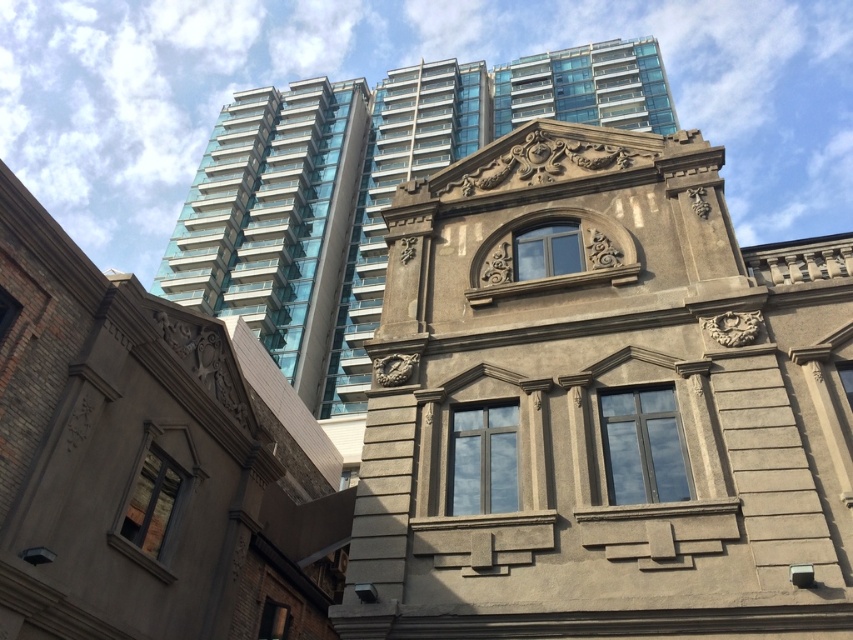
Question: Which object is farther from the camera taking this photo?

Choices:
 (A) gold textured clock at center
 (B) smooth concrete building at center
 (C) glassy blue skyscraper at upper center

Answer: (C)

Question: Among these points, which one is farthest from the camera?

Choices:
 (A) (410, 369)
 (B) (653, 125)
 (C) (483, 417)

Answer: (B)

Question: Is smooth concrete building at center bigger than glassy blue skyscraper at upper center?

Choices:
 (A) no
 (B) yes

Answer: (A)

Question: Does smooth concrete building at center have a greater width compared to gold textured clock at center?

Choices:
 (A) no
 (B) yes

Answer: (B)

Question: Which object appears closest to the camera in this image?

Choices:
 (A) glassy blue skyscraper at upper center
 (B) gold textured clock at center
 (C) smooth concrete building at center

Answer: (C)

Question: Does smooth concrete building at center have a lesser width compared to glassy blue skyscraper at upper center?

Choices:
 (A) no
 (B) yes

Answer: (B)